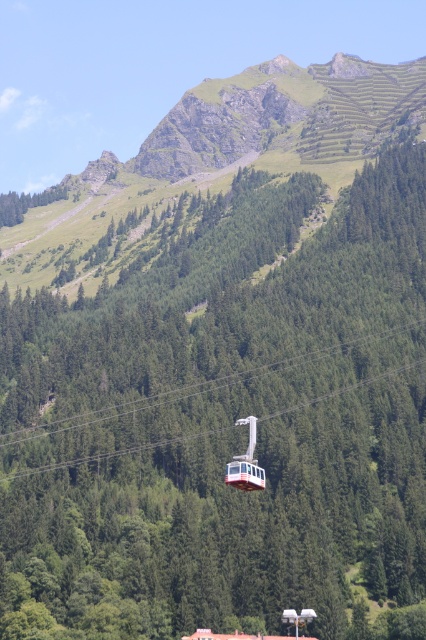
You are a hiker standing at the base of the mountain looking up. You see a point marked at coordinate (245, 461). What object is this point located on?

The point at coordinate (245, 461) is located on the white glossy cable car at center.

Based on the coordinates provided, what does the point at (216, 157) represent in the mountainous landscape?

The point at (216, 157) represents the green grassy mountain at upper center.